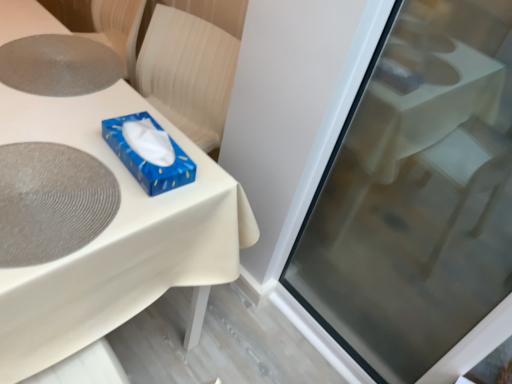
You are a GUI agent. You are given a task and a screenshot of the screen. Output one action in this format:
    pyautogui.click(x=<x>, y=<y>)
    Task: Click on the free space below gray textured placemat at upper left, which is the first oval from back to front (from a real-world perspective)
    The image size is (512, 384).
    Given the screenshot: What is the action you would take?
    pyautogui.click(x=58, y=60)